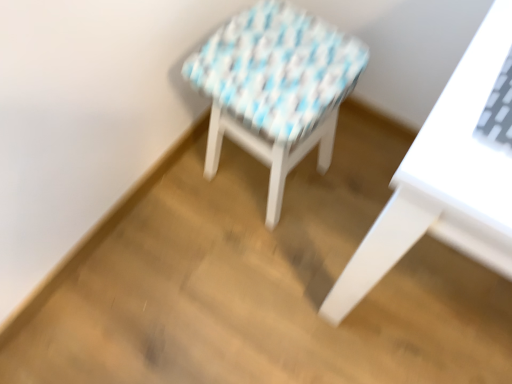
At what (x,y) coordinates should I click in order to perform the action: click on space that is in front of white woven stool at center. Please return your answer as a coordinate pair (x, y). Looking at the image, I should click on (245, 260).